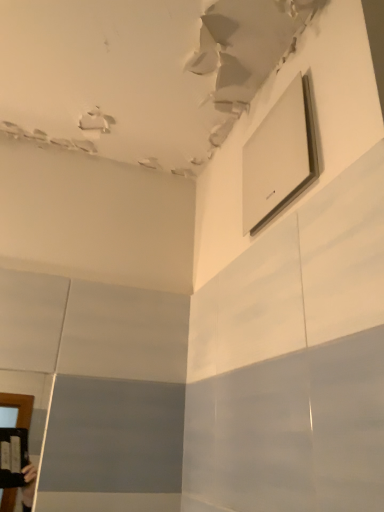
What do you see at coordinates (280, 157) in the screenshot? I see `white glossy medicine cabinet at upper center` at bounding box center [280, 157].

The image size is (384, 512). I want to click on white glossy medicine cabinet at upper center, so click(280, 157).

In order to click on white glossy medicine cabinet at upper center in this screenshot , I will do `click(280, 157)`.